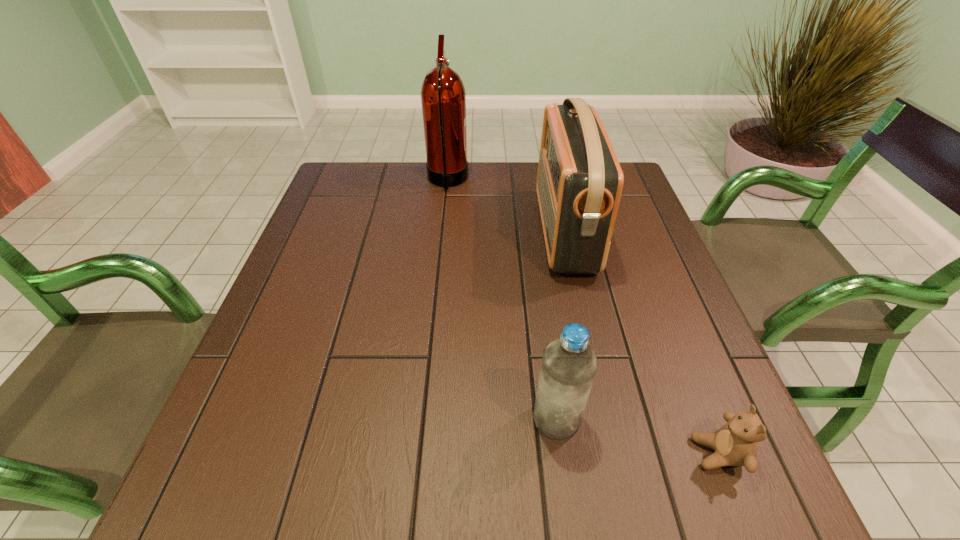
Locate an element on the screen. vacant space that satisfies the following two spatial constraints: 1. on the front-facing side of the leftmost object; 2. on the left side of the water bottle is located at coordinates (424, 419).

Locate an element on the screen. The image size is (960, 540). vacant region that satisfies the following two spatial constraints: 1. on the back side of the water bottle; 2. on the front-facing side of the fire extinguisher is located at coordinates (524, 181).

In order to click on vacant space that satisfies the following two spatial constraints: 1. on the front-facing side of the water bottle; 2. on the left side of the leftmost object in this screenshot , I will do `click(424, 419)`.